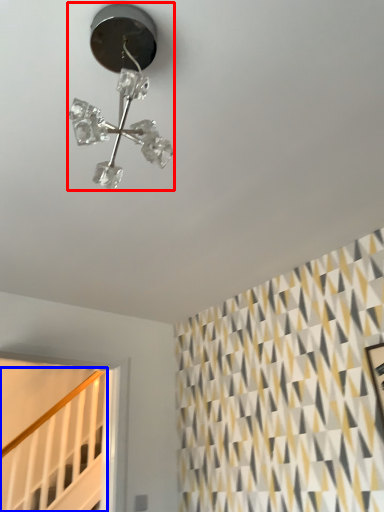
Question: Which point is closer to the camera, lamp (highlighted by a red box) or stairwell (highlighted by a blue box)?

Choices:
 (A) lamp
 (B) stairwell

Answer: (A)